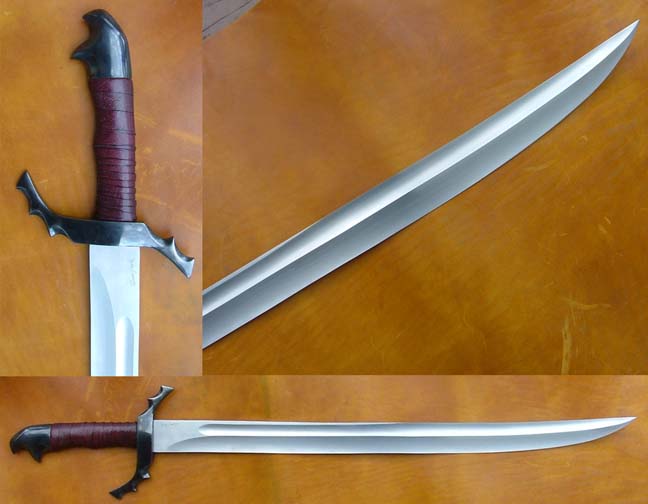
Locate an element on the screen. This screenshot has width=648, height=504. surface is located at coordinates (411, 473).